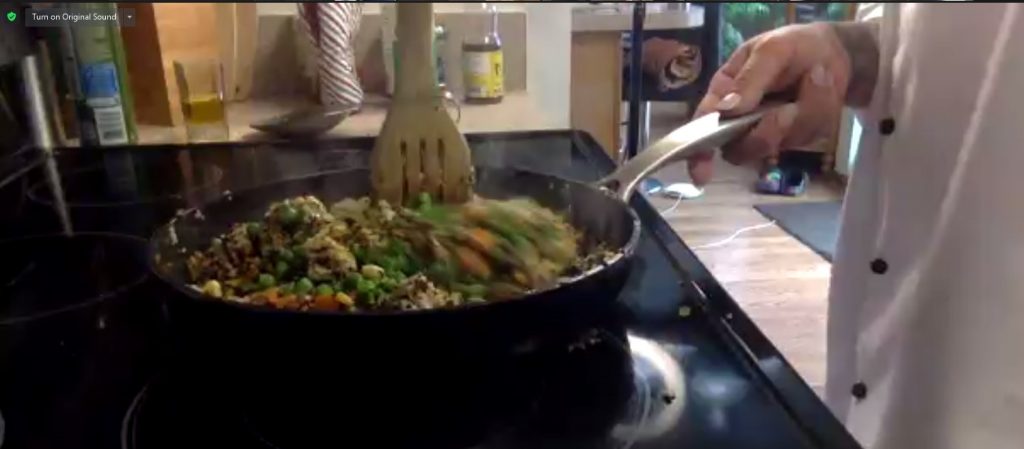
Where is `wooden spoon`? The height and width of the screenshot is (449, 1024). wooden spoon is located at coordinates (417, 132), (416, 41).